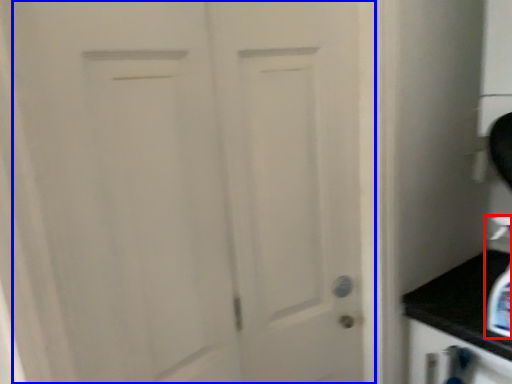
Question: Among these objects, which one is farthest to the camera, soap dispenser (highlighted by a red box) or door (highlighted by a blue box)?

Choices:
 (A) soap dispenser
 (B) door

Answer: (A)